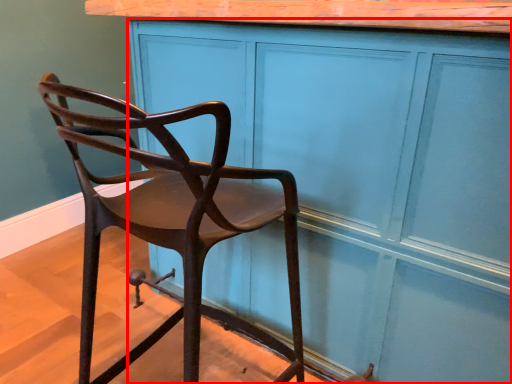
Question: From the image, what is the correct spatial relationship of cabinetry (annotated by the red box) in relation to chair?

Choices:
 (A) left
 (B) right

Answer: (B)